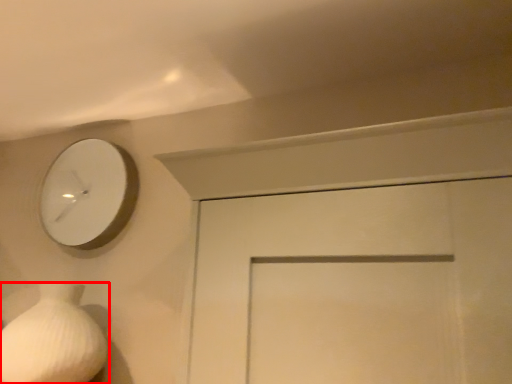
Question: From the image's perspective, what is the correct spatial positioning of vase (annotated by the red box) in reference to wall clock?

Choices:
 (A) below
 (B) above

Answer: (A)